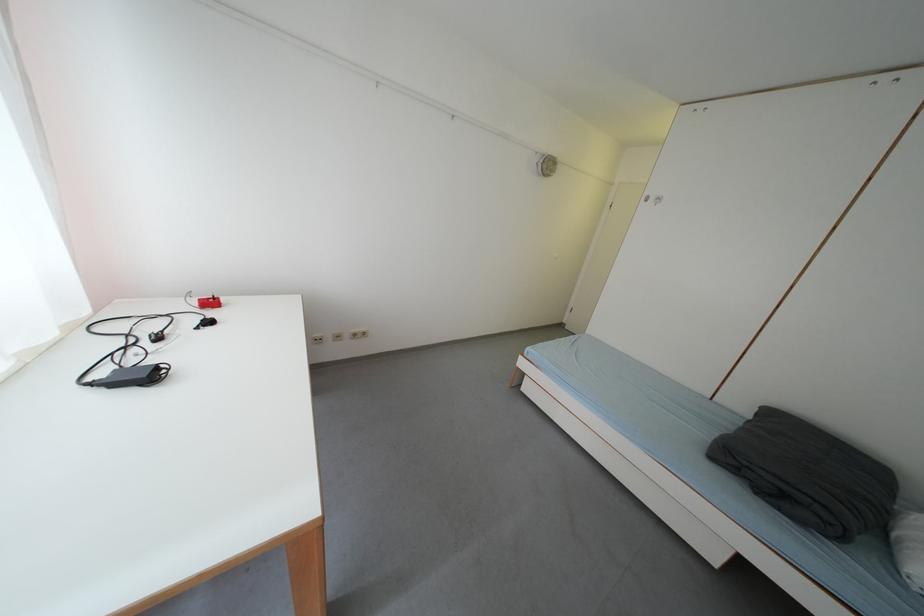
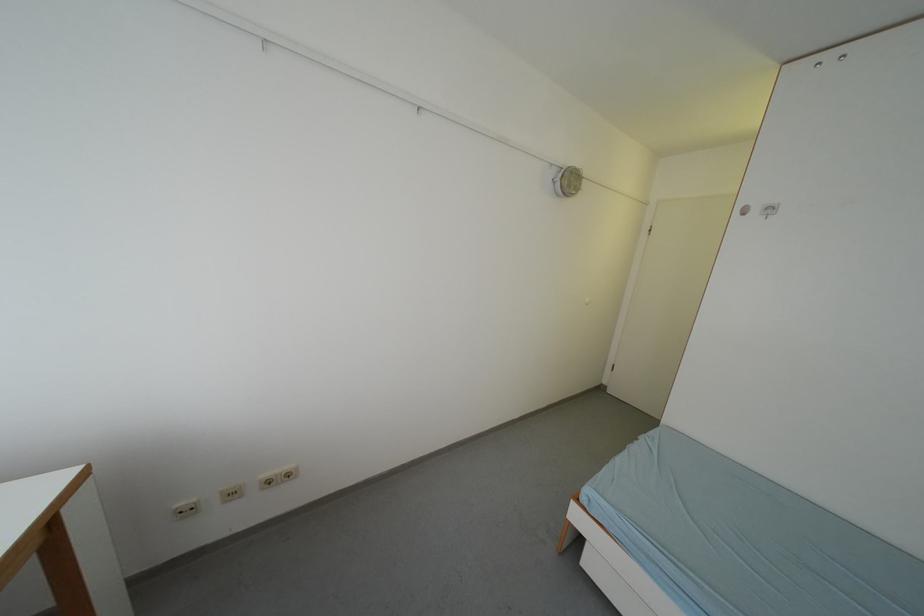
Question: Based on the continuous images, in which direction is the camera rotating? Reply with the corresponding letter.

Choices:
 (A) Left
 (B) Right
 (C) Up
 (D) Down

Answer: (C)